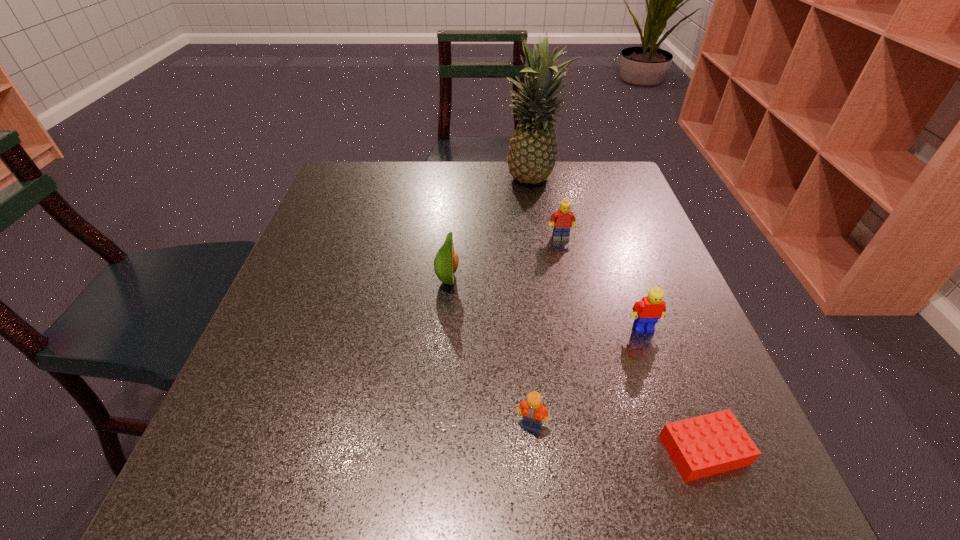
Identify the location of free space between the farthest Lego and the tallest object. (546, 210).

What are the coordinates of `blank region between the avocado and the leftmost Lego` in the screenshot? It's located at (490, 353).

At what (x,y) coordinates should I click in order to perform the action: click on unoccupied area between the shortest object and the fifth nearest object. Please return your answer as a coordinate pair (x, y). The width and height of the screenshot is (960, 540). Looking at the image, I should click on (632, 344).

You are a GUI agent. You are given a task and a screenshot of the screen. Output one action in this format:
    pyautogui.click(x=<x>, y=<y>)
    Task: Click on the empty space between the fifth tallest object and the farthest object
    
    Given the screenshot: What is the action you would take?
    pyautogui.click(x=532, y=303)

Locate an element on the screen. vacant region between the leftmost Lego and the tallest object is located at coordinates (532, 303).

The height and width of the screenshot is (540, 960). What are the coordinates of `vacant area that lies between the second shortest object and the second farthest object` in the screenshot? It's located at (546, 332).

Find the location of a particular element. object that stands as the closest to the leftmost Lego is located at coordinates (714, 443).

In order to click on object identified as the fifth closest to the shortest object in this screenshot , I will do [533, 151].

Image resolution: width=960 pixels, height=540 pixels. In order to click on the second closest Lego to the pineapple in this screenshot , I will do 647,311.

Locate an element on the screen. Lego that is the closest one to the leftmost Lego is located at coordinates (714, 443).